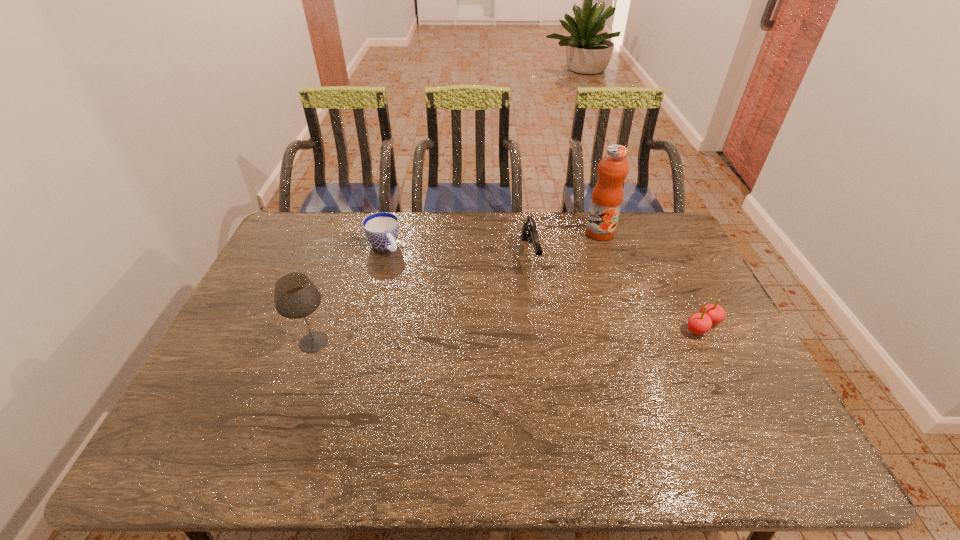
This screenshot has height=540, width=960. Find the location of `free space on the desktop that is between the fourth shortest object and the cherry and is positioned at the end of the barrel of the third tallest object`. free space on the desktop that is between the fourth shortest object and the cherry and is positioned at the end of the barrel of the third tallest object is located at coordinates (551, 333).

The width and height of the screenshot is (960, 540). In order to click on vacant space on the desktop that is between the second tallest object and the cherry and is positioned on the side of the cup with the handle in this screenshot , I will do `click(468, 336)`.

Locate an element on the screen. This screenshot has width=960, height=540. free space on the desktop that is between the second tallest object and the rightmost object and is positioned on the front label of the fruit juice is located at coordinates (544, 333).